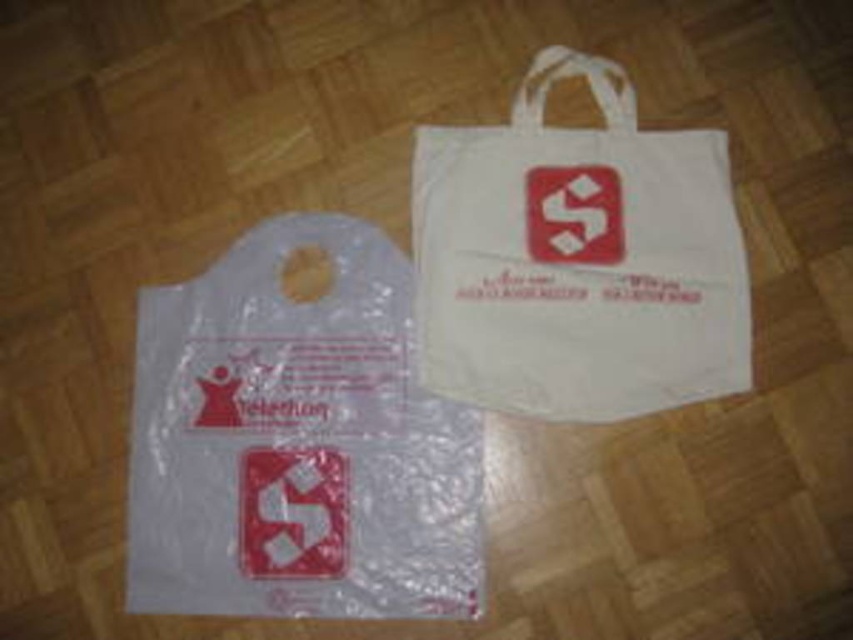
Between transparent plastic bag at lower left and white fabric bag at upper right, which one has less height?

Standing shorter between the two is white fabric bag at upper right.

Is point (270, 272) positioned after point (721, 131)?

No, (270, 272) is in front of (721, 131).

Which is in front, point (250, 451) or point (587, 76)?

Point (250, 451) is more forward.

Find the location of a particular element. The width and height of the screenshot is (853, 640). transparent plastic bag at lower left is located at coordinates (x=297, y=442).